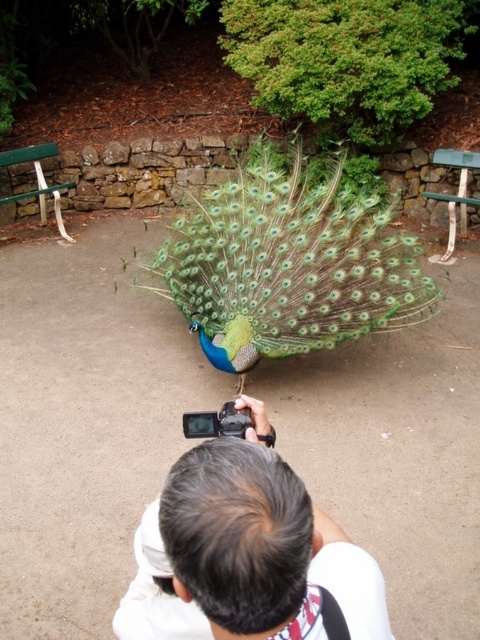
You are a photographer trying to capture a detailed shot of the gray hair at center and the green plastic bench at upper right. Which object should you zoom in on to ensure it fills more of your camera frame?

The gray hair at center has a smaller size compared to the green plastic bench at upper right, so you should zoom in on the gray hair at center to make it larger in the frame.

You are a photographer standing in the park. You notice the gray hair at center and the green painted wood park bench at left. Which object is blocking your view of the other?

The gray hair at center is blocking the view of the green painted wood park bench at left because it is positioned in front of it.

You are a photographer standing in a park. You notice a gray hair at center and a green plastic bench at upper right. Which object is closer to the ground?

The gray hair at center is closer to the ground because it is below the green plastic bench at upper right.